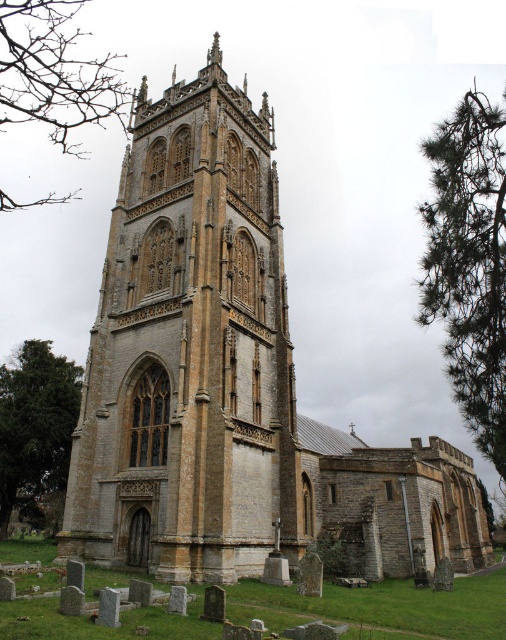
You are standing in a field 45 meters away from the yellow stone tower at center. Can you safely approach the tower without getting too close? Explain your reasoning.

The yellow stone tower at center is 47.01 meters away from the viewer. Since you are already 45 meters away, you are still 2.01 meters away from the tower and can safely approach without getting too close.

You are standing in front of the historic church and want to take a photo of the tower. The bare branches at upper left are blocking part of the tower. Can you estimate how far to the left you should move to avoid them?

The bare branches at upper left are located at point 0.107 on the horizontal axis. Moving slightly to the right would position you to the right of this point, thus avoiding the branches.